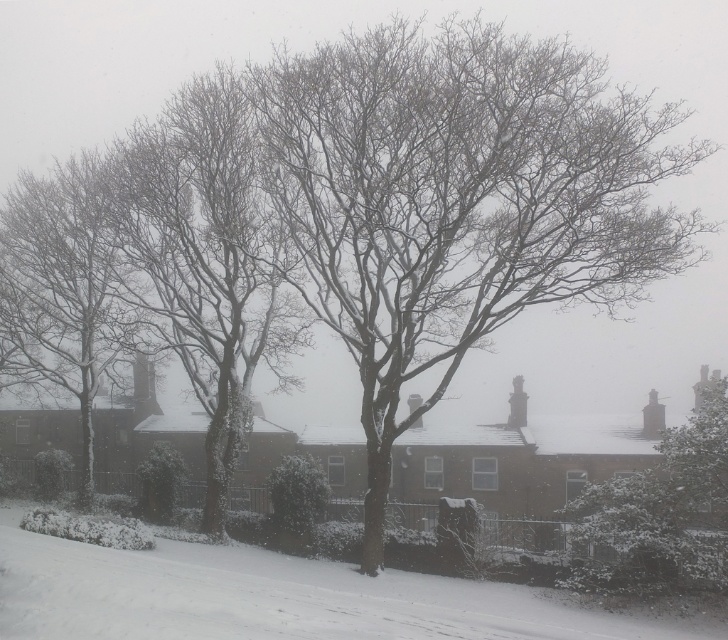
Question: Does white fluffy snow at lower center have a larger size compared to bare branches at left?

Choices:
 (A) yes
 (B) no

Answer: (B)

Question: Which of the following is the farthest from the observer?

Choices:
 (A) snow-covered branches at left
 (B) bare branches at left
 (C) white fluffy snow at lower center

Answer: (A)

Question: Does bare branches at center have a smaller size compared to white fluffy snow at lower center?

Choices:
 (A) yes
 (B) no

Answer: (B)

Question: Which of the following is the closest to the observer?

Choices:
 (A) bare branches at left
 (B) white fluffy snow at lower center

Answer: (B)

Question: Does bare branches at center appear under white fluffy snow at lower center?

Choices:
 (A) yes
 (B) no

Answer: (B)

Question: Which of the following is the farthest from the observer?

Choices:
 (A) snow-covered branches at left
 (B) white fluffy snow at lower center
 (C) snow-covered tree at center
 (D) bare branches at left

Answer: (A)